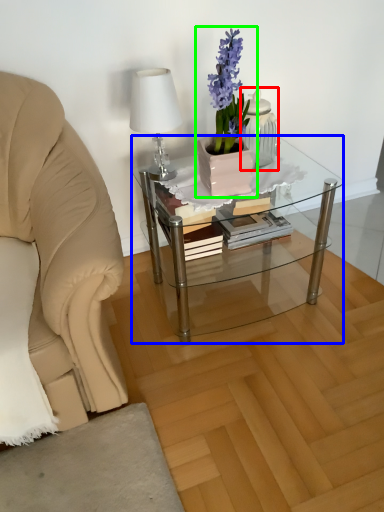
Question: Considering the real-world distances, which object is farthest from tableware (highlighted by a red box)? coffee table (highlighted by a blue box) or houseplant (highlighted by a green box)?

Choices:
 (A) coffee table
 (B) houseplant

Answer: (A)